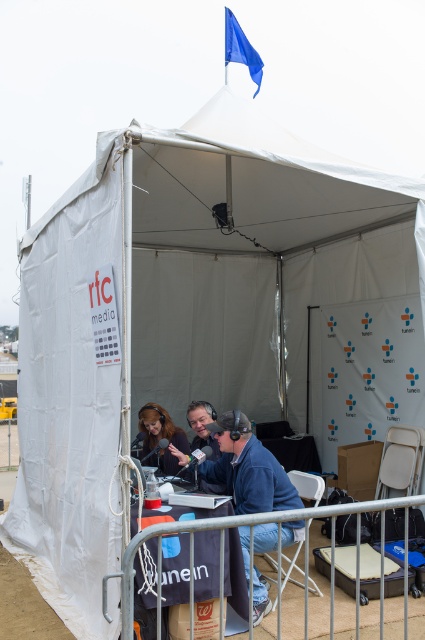
You are standing outside the tent and want to reach the blue fabric jacket at center inside. The tent entrance is 3 meters away from you. Can you walk straight to the jacket without needing to move around any obstacles?

The blue fabric jacket at center is 4.05 meters away from viewer, and the entrance is 3 meters away. Since the jacket is further inside than the entrance distance, you can walk straight in but may need to navigate through the tent space carefully, as there might be obstacles like the table or people around it.

You are a technician setting up equipment in the tent. You need to place the blue fabric jacket at center and the matte black headphones at center on the table such that they are exactly 30 inches apart. Can you position them as required?

The distance between the blue fabric jacket at center and the matte black headphones at center is currently 31.44 inches. To meet the requirement of 30 inches, you would need to move them closer by approximately 1.44 inches.